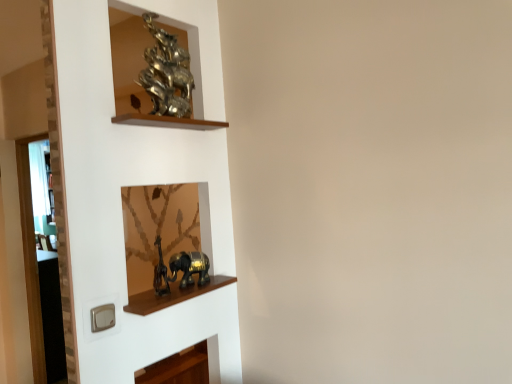
Question: Based on their sizes in the image, would you say gold metallic elephant at lower center, acting as the 2th art starting from the top, is bigger or smaller than wooden shelf at upper center, marked as the first cabinet in a top-to-bottom arrangement?

Choices:
 (A) small
 (B) big

Answer: (B)

Question: From their relative heights in the image, would you say gold metallic elephant at lower center, acting as the 2th art starting from the top, is taller or shorter than wooden shelf at upper center, the 2th cabinet ordered from the bottom?

Choices:
 (A) short
 (B) tall

Answer: (B)

Question: Which object is positioned closest to the wooden shelf at upper center, the 2th cabinet ordered from the bottom?

Choices:
 (A) metallic gold elephant at center, placed as the second cabinet when sorted from top to bottom
 (B) shiny metallic sculpture at upper left, which is the 2th art in bottom-to-top order
 (C) gold metallic elephant at lower center, the 1th art when ordered from bottom to top

Answer: (B)

Question: Estimate the real-world distances between objects in this image. Which object is farther from the metallic gold elephant at center, placed as the second cabinet when sorted from top to bottom?

Choices:
 (A) gold metallic elephant at lower center, the 1th art when ordered from bottom to top
 (B) shiny metallic sculpture at upper left, which is the 2th art in bottom-to-top order
 (C) wooden shelf at upper center, marked as the first cabinet in a top-to-bottom arrangement

Answer: (B)